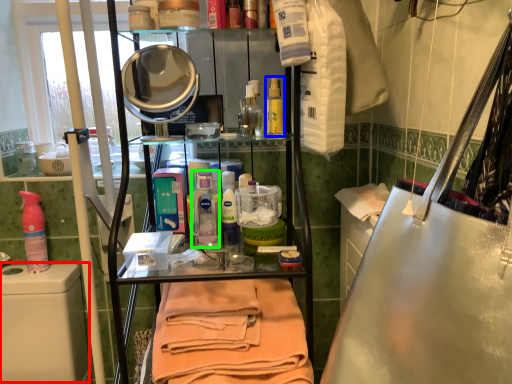
Question: Considering the real-world distances, which object is closest to washing (highlighted by a red box)? mouthwash (highlighted by a blue box) or cleaning product (highlighted by a green box).

Choices:
 (A) mouthwash
 (B) cleaning product

Answer: (B)